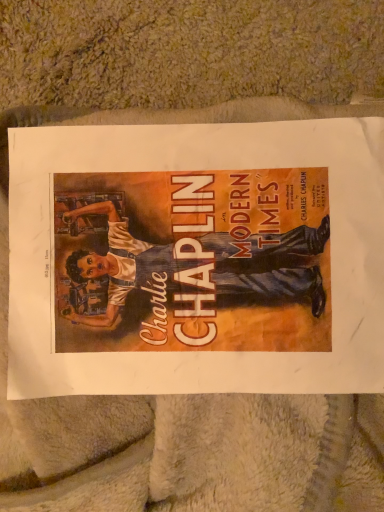
What do you see at coordinates (197, 258) in the screenshot? I see `matte paper poster at center` at bounding box center [197, 258].

Consider the image. Measure the distance between matte paper poster at center and camera.

The depth of matte paper poster at center is 12.60 inches.

At what (x,y) coordinates should I click in order to perform the action: click on matte paper poster at center. Please return your answer as a coordinate pair (x, y). The image size is (384, 512). Looking at the image, I should click on (197, 258).

At what (x,y) coordinates should I click in order to perform the action: click on matte paper poster at center. Please return your answer as a coordinate pair (x, y). This screenshot has width=384, height=512. Looking at the image, I should click on (197, 258).